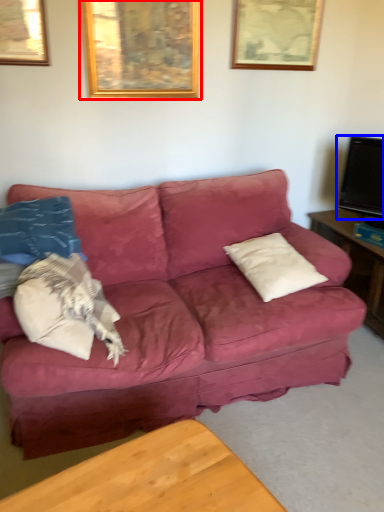
Question: Which point is closer to the camera, picture frame (highlighted by a red box) or television (highlighted by a blue box)?

Choices:
 (A) picture frame
 (B) television

Answer: (A)